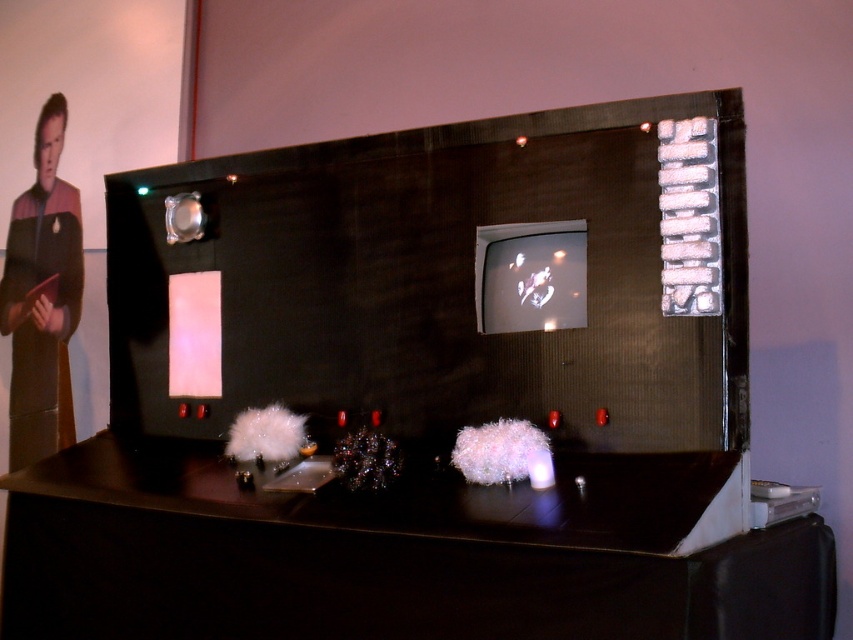
You are a crew member on a spaceship who needs to place a 1.1 meter long tool on the dark wood table at center. The uniform fabric man at left is holding the tool. Can you hand the tool to the table without it touching the man?

The dark wood table at center is 1.20 meters from the uniform fabric man at left. Since the tool is 1.1 meters long, the man can hold one end and place the other end on the table without the tool touching him.

You are organizing a sci fi convention booth and need to place both the dark wood table at center and the uniform fabric man at left. Given their sizes, which object should you place first to ensure they both fit on the display area?

The dark wood table at center is bigger than the uniform fabric man at left, so you should place the dark wood table at center first to ensure both fit on the display area.

Looking at this image, you are a guest at a futuristic event and notice a dark wood table at center and a uniform fabric man at left. Which object is shorter?

The dark wood table at center is shorter than the uniform fabric man at left.